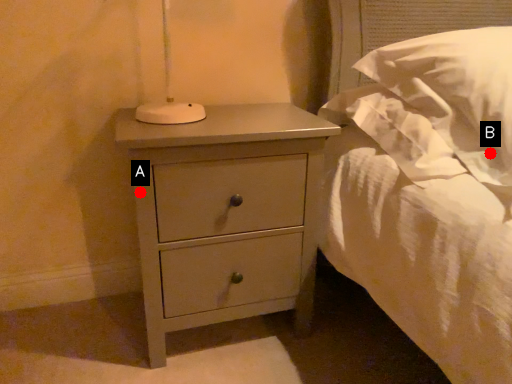
Question: Two points are circled on the image, labeled by A and B beside each circle. Which point is farther to the camera?

Choices:
 (A) A is further
 (B) B is further

Answer: (A)